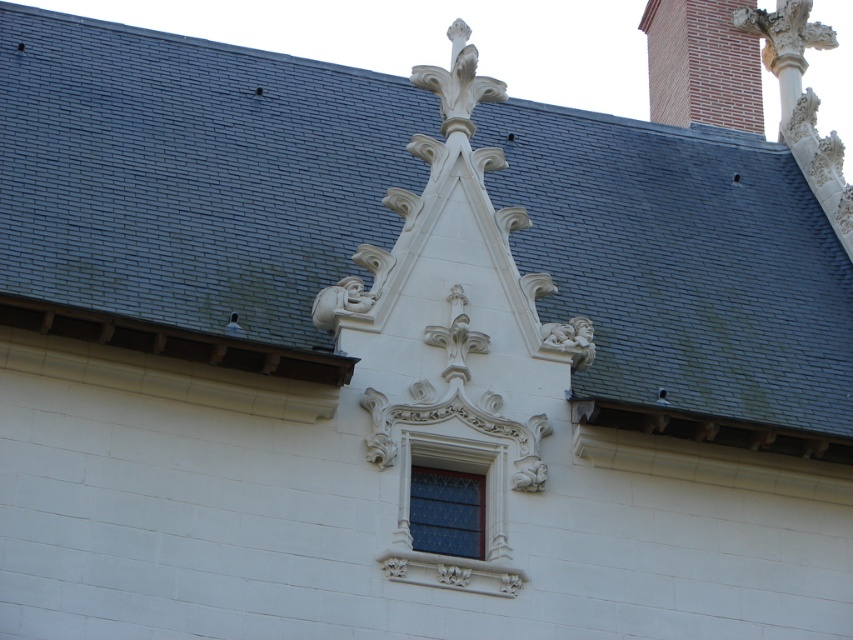
Describe the element at coordinates (701, 65) in the screenshot. The width and height of the screenshot is (853, 640). I see `red brick chimney at upper right` at that location.

Can you confirm if red brick chimney at upper right is shorter than stained glass window at center?

In fact, red brick chimney at upper right may be taller than stained glass window at center.

Is point (738, 116) behind point (450, 476)?

That is True.

The image size is (853, 640). What are the coordinates of `red brick chimney at upper right` in the screenshot? It's located at (701, 65).